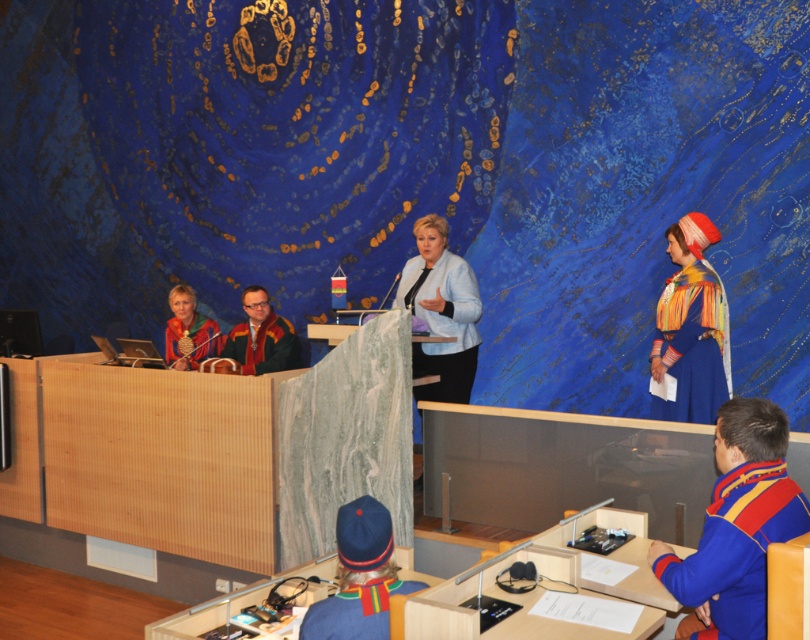
Does blue velvet dress at right appear on the right side of blue fabric hat at lower center?

Correct, you'll find blue velvet dress at right to the right of blue fabric hat at lower center.

Which is in front, point (655, 349) or point (347, 536)?

Point (347, 536)

I want to click on blue velvet dress at right, so click(689, 346).

You are a GUI agent. You are given a task and a screenshot of the screen. Output one action in this format:
    pyautogui.click(x=<x>, y=<y>)
    Task: Click on the blue velvet dress at right
    This screenshot has width=810, height=640.
    Given the screenshot: What is the action you would take?
    pyautogui.click(x=689, y=346)

Does blue woolen sweater at lower right come in front of light blue fabric jacket at center?

Yes, it is in front of light blue fabric jacket at center.

Can you confirm if blue woolen sweater at lower right is positioned below light blue fabric jacket at center?

Yes, blue woolen sweater at lower right is below light blue fabric jacket at center.

Measure the distance between point [723,637] and camera.

Point [723,637] and camera are 9.33 feet apart.

Where is `blue woolen sweater at lower right`? This screenshot has width=810, height=640. blue woolen sweater at lower right is located at coordinates (736, 548).

Is blue fabric uniform at lower center shorter than matte red leather bag at left?

Yes.

Does blue fabric uniform at lower center lie in front of matte red leather bag at left?

Yes, blue fabric uniform at lower center is closer to the viewer.

Measure the distance between blue fabric uniform at lower center and camera.

A distance of 2.60 meters exists between blue fabric uniform at lower center and camera.

Find the location of a particular element. The width and height of the screenshot is (810, 640). blue fabric uniform at lower center is located at coordinates (356, 611).